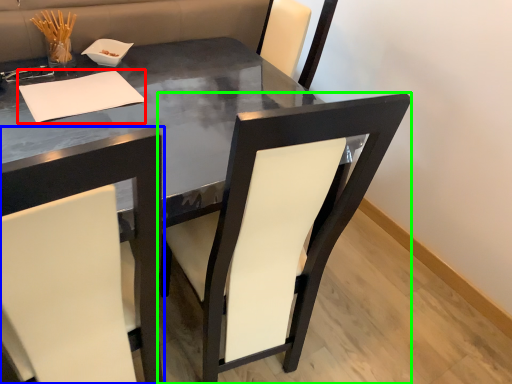
Question: Based on their relative distances, which object is nearer to notepad (highlighted by a red box)? Choose from chair (highlighted by a blue box) and chair (highlighted by a green box).

Choices:
 (A) chair
 (B) chair

Answer: (B)